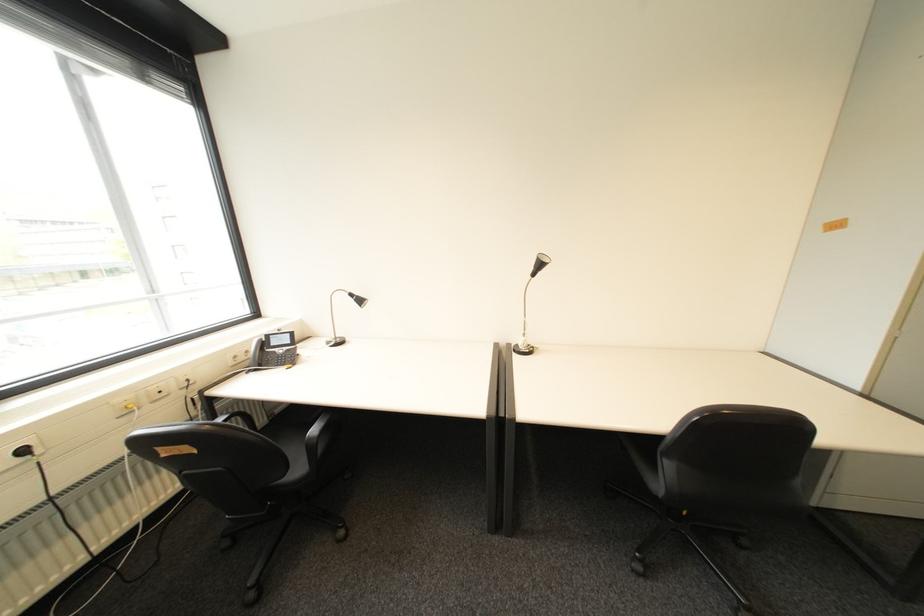
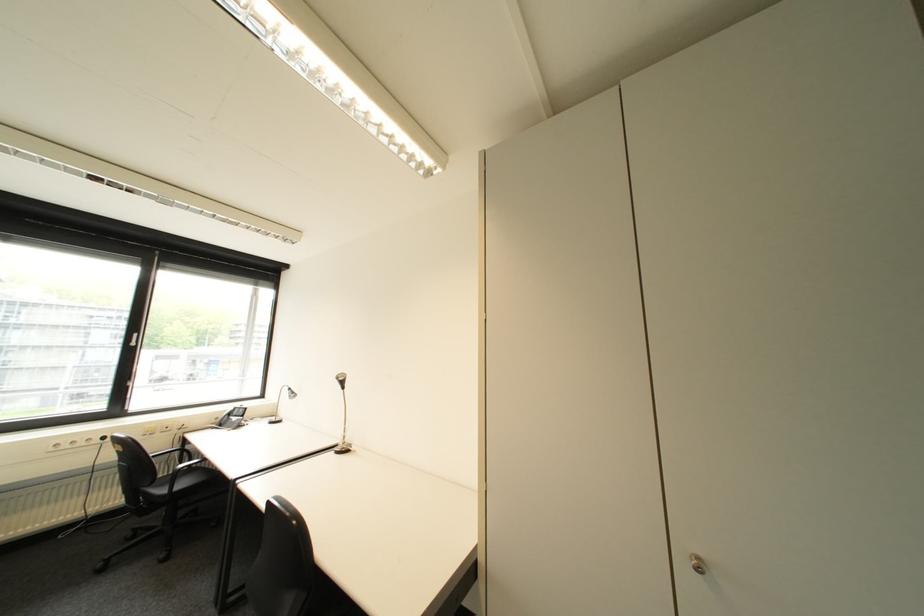
The point at (34, 452) is marked in the first image. Where is the corresponding point in the second image?

(114, 439)